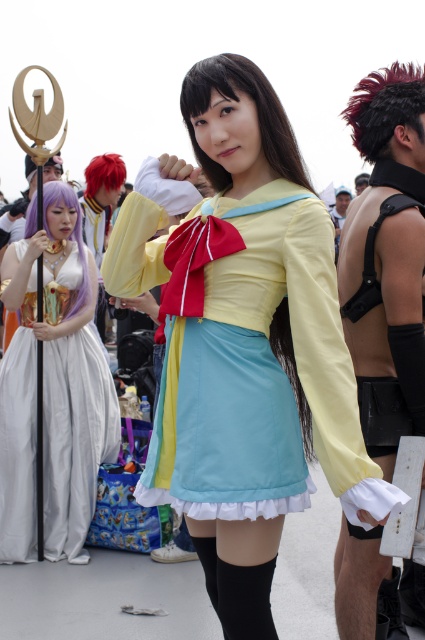
Which is below, satin yellow wig at center or purple silky wig at upper left?

purple silky wig at upper left is below.

Is the position of satin yellow wig at center more distant than that of purple silky wig at upper left?

No, it is in front of purple silky wig at upper left.

Is point (221, 177) behind point (78, 204)?

No.

I want to click on satin yellow wig at center, so click(238, 100).

Is shiny black leather vest at right smaller than purple silky wig at upper left?

No, shiny black leather vest at right is not smaller than purple silky wig at upper left.

Does shiny black leather vest at right have a larger size compared to purple silky wig at upper left?

Indeed, shiny black leather vest at right has a larger size compared to purple silky wig at upper left.

Is point (380, 449) positioned after point (76, 298)?

That is False.

In order to click on shiny black leather vest at right in this screenshot , I will do `click(387, 259)`.

Does shiny black leather vest at right lie behind silky white dress at left?

Result: That is False.

Does point (388, 465) lie behind point (119, 420)?

No.

In order to click on shiny black leather vest at right in this screenshot , I will do `click(387, 259)`.